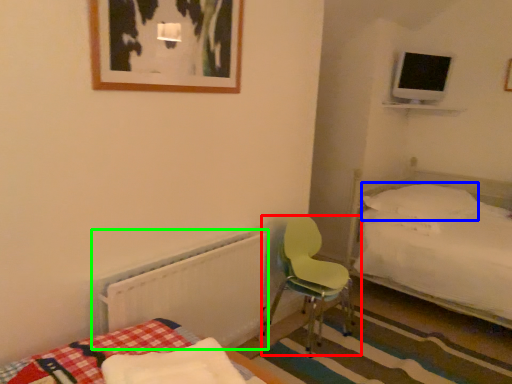
Question: Considering the real-world distances, which object is closest to chair (highlighted by a red box)? pillow (highlighted by a blue box) or radiator (highlighted by a green box).

Choices:
 (A) pillow
 (B) radiator

Answer: (B)